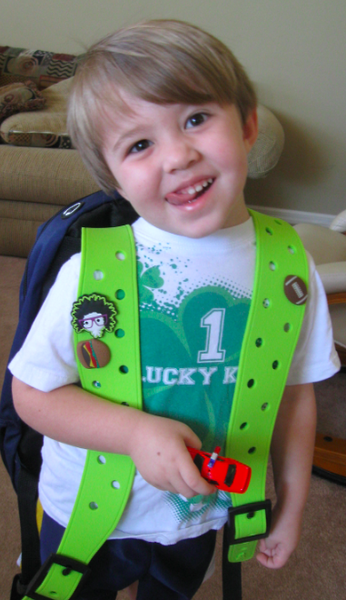
At what (x,y) coordinates should I click in order to perform the action: click on pillow. Please return your answer as a coordinate pair (x, y). Looking at the image, I should click on (22, 97).